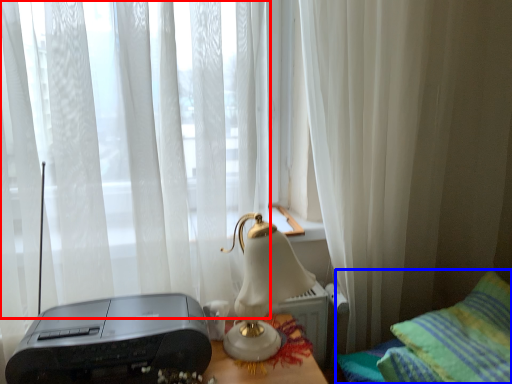
Question: Among these objects, which one is nearest to the camera, curtain (highlighted by a red box) or furniture (highlighted by a blue box)?

Choices:
 (A) curtain
 (B) furniture

Answer: (B)